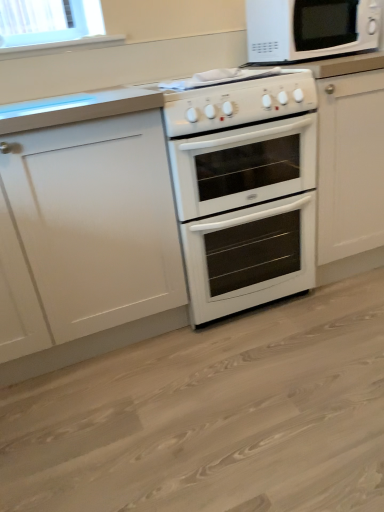
Question: Looking at the image, does white glossy gas stove at center seem bigger or smaller compared to white glossy microwave at upper right?

Choices:
 (A) big
 (B) small

Answer: (A)

Question: Considering the positions of point (231, 77) and point (261, 33), is point (231, 77) closer or farther from the camera than point (261, 33)?

Choices:
 (A) closer
 (B) farther

Answer: (A)

Question: Estimate the real-world distances between objects in this image. Which object is farther from the white glossy oven at center?

Choices:
 (A) white glossy oven at center
 (B) white glossy microwave at upper right
 (C) white glossy gas stove at center
 (D) white matte cabinet at left

Answer: (B)

Question: Considering the real-world distances, which object is farthest from the white glossy gas stove at center?

Choices:
 (A) white glossy microwave at upper right
 (B) white glossy oven at center
 (C) white matte cabinet at left
 (D) white glossy oven at center

Answer: (B)